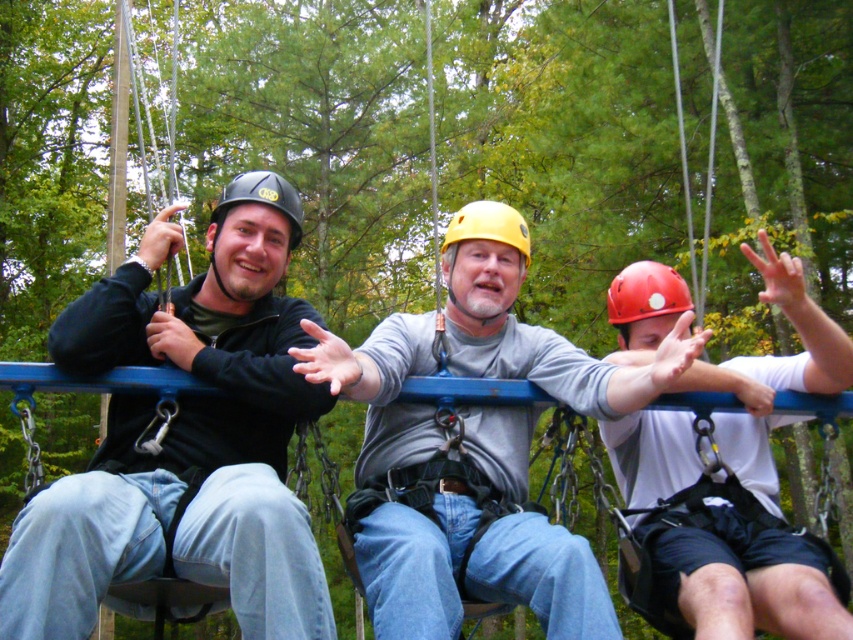
Question: Which point is farther to the camera?

Choices:
 (A) (511, 237)
 (B) (242, 193)
 (C) (706, 572)

Answer: (A)

Question: Estimate the real-world distances between objects in this image. Which object is closer to the yellow matte helmet at center?

Choices:
 (A) black matte helmet at center
 (B) matte white helmet at center
 (C) gray matte helmet at center
 (D) matte black helmet at center

Answer: (C)

Question: Which point appears farthest from the camera in this image?

Choices:
 (A) (746, 246)
 (B) (257, 184)

Answer: (B)

Question: Is gray matte helmet at center bigger than black matte helmet at center?

Choices:
 (A) yes
 (B) no

Answer: (A)

Question: Is matte black helmet at center bigger than yellow matte helmet at center?

Choices:
 (A) yes
 (B) no

Answer: (A)

Question: Can you confirm if matte black helmet at center is smaller than black matte helmet at center?

Choices:
 (A) yes
 (B) no

Answer: (B)